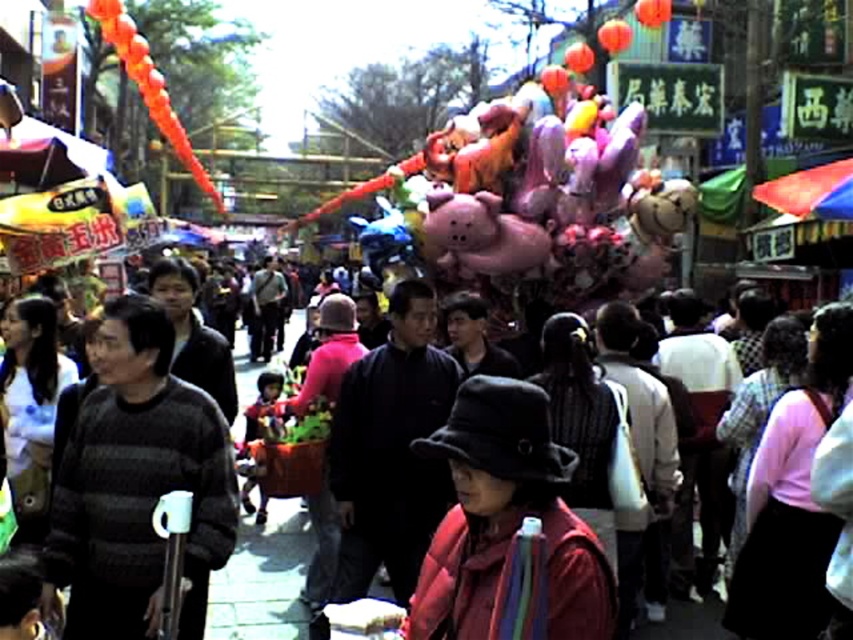
You are a delivery person who needs to place a package between the striped sweater at center and the dark gray sweater at center. The package requires 3 meters of space. Is there enough space between them?

The striped sweater at center is 3.06 meters from dark gray sweater at center, so yes, there is enough space to place the package between them since 3.06 meters exceeds the required 3 meters.

You are a customer at the market and want to buy a sweater. You see both the striped sweater at center and the dark gray sweater at center. Which one is more visible to you from your current position?

The striped sweater at center is more visible because it is in front of the dark gray sweater at center.

You are a customer at the market and want to find the striped sweater at center. According to the coordinates provided, where should you look to find it?

The striped sweater at center is located at coordinates point (137, 484).